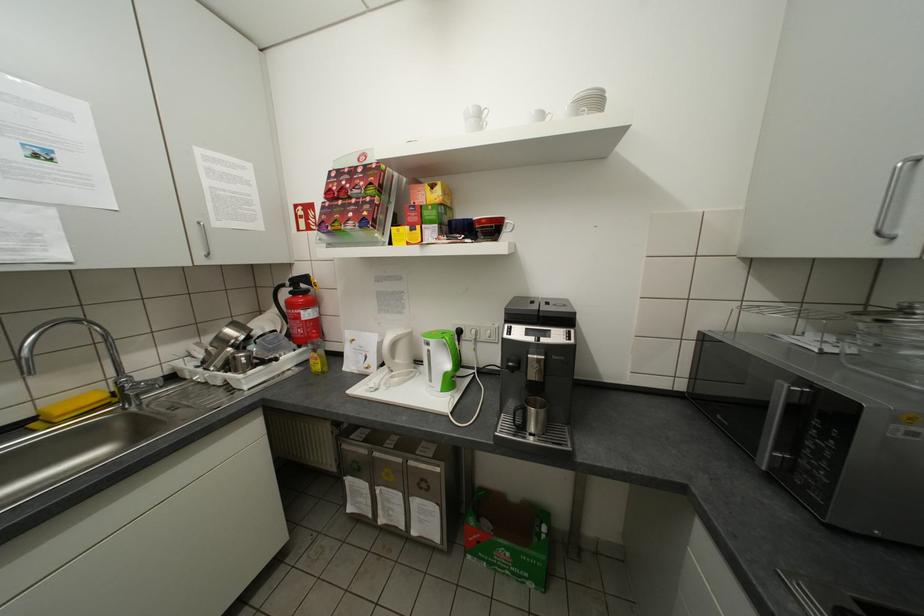
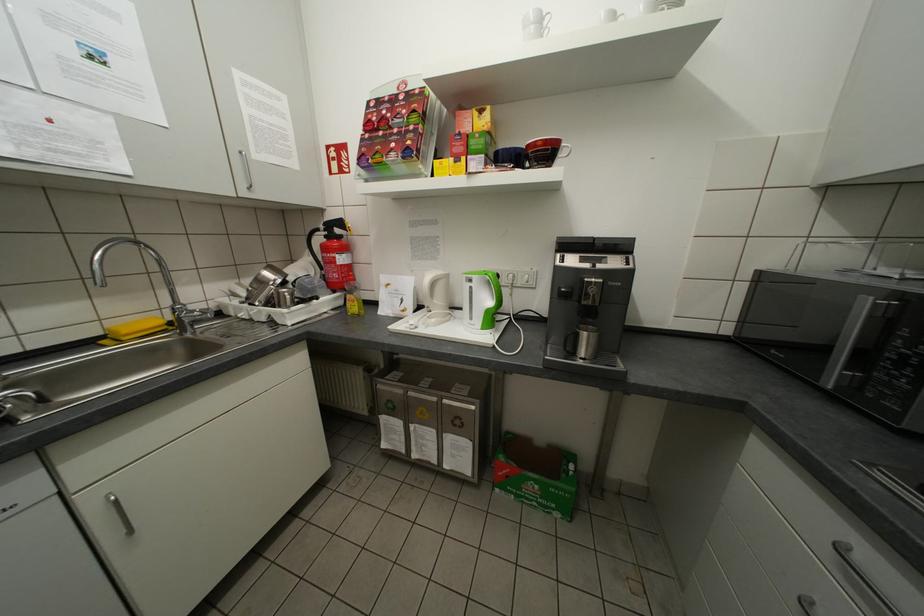
Locate, in the second image, the point that corresponds to the point at 292,286 in the first image.

(325, 230)